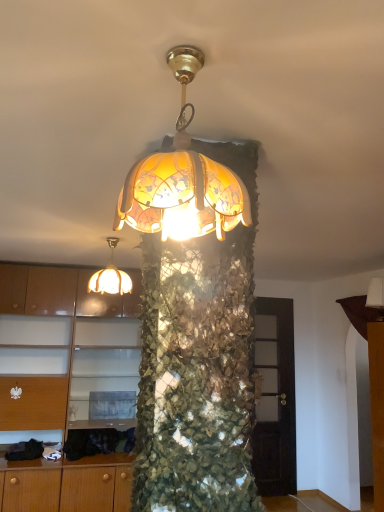
How much space does translucent glass lampshade at center, which is the first lamp in front-to-back order, occupy horizontally?

27.78 centimeters.

This screenshot has width=384, height=512. What do you see at coordinates (182, 179) in the screenshot?
I see `translucent glass lampshade at center, the second lamp when ordered from right to left` at bounding box center [182, 179].

This screenshot has width=384, height=512. I want to click on translucent glass lampshade at center, the third lamp positioned from the back, so click(182, 179).

Considering the relative positions of translucent glass lampshade at center, the 2th lamp in the left-to-right sequence, and translucent glass lampshade at upper center, which ranks as the first lamp in left-to-right order, in the image provided, is translucent glass lampshade at center, the 2th lamp in the left-to-right sequence, to the left or to the right of translucent glass lampshade at upper center, which ranks as the first lamp in left-to-right order,?

Based on their positions, translucent glass lampshade at center, the 2th lamp in the left-to-right sequence, is located to the right of translucent glass lampshade at upper center, which ranks as the first lamp in left-to-right order.

Does translucent glass lampshade at center, which is the first lamp in front-to-back order, touch translucent glass lampshade at upper center, which ranks as the first lamp in left-to-right order?

translucent glass lampshade at center, which is the first lamp in front-to-back order, and translucent glass lampshade at upper center, which ranks as the first lamp in left-to-right order, are clearly separated.

Can you confirm if translucent glass lampshade at center, the third lamp positioned from the back, is taller than translucent glass lampshade at upper center, which ranks as the 2th lamp in back-to-front order?

Correct, translucent glass lampshade at center, the third lamp positioned from the back, is much taller as translucent glass lampshade at upper center, which ranks as the 2th lamp in back-to-front order.

Which object is positioned more to the right, translucent glass lampshade at upper center, which ranks as the 2th lamp in back-to-front order, or matte wood cabinet at left?

translucent glass lampshade at upper center, which ranks as the 2th lamp in back-to-front order.

Which of these two, translucent glass lampshade at upper center, which ranks as the first lamp in left-to-right order, or matte wood cabinet at left, is thinner?

Thinner between the two is translucent glass lampshade at upper center, which ranks as the first lamp in left-to-right order.

Are translucent glass lampshade at upper center, which ranks as the first lamp in left-to-right order, and matte wood cabinet at left making contact?

translucent glass lampshade at upper center, which ranks as the first lamp in left-to-right order, and matte wood cabinet at left are clearly separated.

Is matte wood cabinet at left surrounding translucent glass lampshade at center, the third lamp positioned from the back?

No, translucent glass lampshade at center, the third lamp positioned from the back, is located outside of matte wood cabinet at left.

Is point (41, 276) positioned behind point (171, 194)?

Yes, point (41, 276) is behind point (171, 194).

From a real-world perspective, relative to translucent glass lampshade at center, which is the first lamp in front-to-back order, is matte wood cabinet at left vertically above or below?

matte wood cabinet at left is below translucent glass lampshade at center, which is the first lamp in front-to-back order.

Considering the sizes of objects matte wood cabinet at left and translucent glass lampshade at center, the 2th lamp in the left-to-right sequence, in the image provided, who is bigger, matte wood cabinet at left or translucent glass lampshade at center, the 2th lamp in the left-to-right sequence,?

matte wood cabinet at left.

You are a GUI agent. You are given a task and a screenshot of the screen. Output one action in this format:
    pyautogui.click(x=<x>, y=<y>)
    Task: Click on the 1st lamp to the right of the translucent glass lampshade at upper center, which ranks as the first lamp in left-to-right order, counting from the anchor's position
    The height and width of the screenshot is (512, 384).
    Given the screenshot: What is the action you would take?
    pyautogui.click(x=182, y=179)

Who is smaller, translucent glass lampshade at upper center, which is the 3th lamp in right-to-left order, or translucent glass lampshade at center, which is the first lamp in front-to-back order?

translucent glass lampshade at upper center, which is the 3th lamp in right-to-left order, is smaller.

Is translucent glass lampshade at upper center, which ranks as the 2th lamp in back-to-front order, taller than translucent glass lampshade at center, the second lamp when ordered from right to left?

No.

Is the surface of matte wood cabinet at left in direct contact with translucent glass lampshade at upper center, which ranks as the 2th lamp in back-to-front order?

No.

Considering the sizes of matte wood cabinet at left and translucent glass lampshade at upper center, which ranks as the first lamp in left-to-right order, in the image, is matte wood cabinet at left wider or thinner than translucent glass lampshade at upper center, which ranks as the first lamp in left-to-right order,?

matte wood cabinet at left is wider than translucent glass lampshade at upper center, which ranks as the first lamp in left-to-right order.

From the image's perspective, which is above, matte wood cabinet at left or translucent glass lampshade at upper center, which is the 3th lamp in right-to-left order?

From the image's view, translucent glass lampshade at upper center, which is the 3th lamp in right-to-left order, is above.

Considering the sizes of matte wood cabinet at left and translucent glass lampshade at upper center, which ranks as the first lamp in left-to-right order, in the image, is matte wood cabinet at left taller or shorter than translucent glass lampshade at upper center, which ranks as the first lamp in left-to-right order,?

In the image, matte wood cabinet at left appears to be taller than translucent glass lampshade at upper center, which ranks as the first lamp in left-to-right order.

In terms of height, does white fabric lampshade at upper right, the first lamp from the back, look taller or shorter compared to translucent glass lampshade at center, the third lamp positioned from the back?

Considering their sizes, white fabric lampshade at upper right, the first lamp from the back, has less height than translucent glass lampshade at center, the third lamp positioned from the back.

Is white fabric lampshade at upper right, the 1th lamp positioned from the right, spatially inside translucent glass lampshade at center, the second lamp when ordered from right to left, or outside of it?

The correct answer is: outside.

Does white fabric lampshade at upper right, acting as the 3th lamp starting from the front, appear on the right side of translucent glass lampshade at center, the third lamp positioned from the back?

Yes, white fabric lampshade at upper right, acting as the 3th lamp starting from the front, is to the right of translucent glass lampshade at center, the third lamp positioned from the back.

Is matte wood cabinet at left at the back of translucent glass lampshade at center, which is the first lamp in front-to-back order?

No, matte wood cabinet at left is not at the back of translucent glass lampshade at center, which is the first lamp in front-to-back order.

From the image's perspective, is translucent glass lampshade at center, which is the first lamp in front-to-back order, on matte wood cabinet at left?

Indeed, from the image's perspective, translucent glass lampshade at center, which is the first lamp in front-to-back order, is shown above matte wood cabinet at left.

From a real-world perspective, is translucent glass lampshade at center, the second lamp when ordered from right to left, below matte wood cabinet at left?

No, from a real-world perspective, translucent glass lampshade at center, the second lamp when ordered from right to left, is not under matte wood cabinet at left.

Who is taller, translucent glass lampshade at center, the third lamp positioned from the back, or matte wood cabinet at left?

With more height is matte wood cabinet at left.

This screenshot has width=384, height=512. In order to click on lamp that is on the left side of translucent glass lampshade at center, which is the first lamp in front-to-back order in this screenshot , I will do `click(110, 276)`.

There is a matte wood cabinet at left. Where is `the 3rd lamp above it (from a real-world perspective)`? the 3rd lamp above it (from a real-world perspective) is located at coordinates (110, 276).

From the picture: When comparing their distances from matte wood cabinet at left, does translucent glass lampshade at center, the second lamp when ordered from right to left, or translucent glass lampshade at upper center, which ranks as the first lamp in left-to-right order, seem further?

translucent glass lampshade at center, the second lamp when ordered from right to left, is positioned further to the anchor matte wood cabinet at left.

When comparing their distances from translucent glass lampshade at upper center, which is the 3th lamp in right-to-left order, does white fabric lampshade at upper right, acting as the 3th lamp starting from the front, or translucent glass lampshade at center, the 2th lamp in the left-to-right sequence, seem further?

white fabric lampshade at upper right, acting as the 3th lamp starting from the front, is positioned further to the anchor translucent glass lampshade at upper center, which is the 3th lamp in right-to-left order.

Which object lies further to the anchor point translucent glass lampshade at center, the third lamp positioned from the back, white fabric lampshade at upper right, the 1th lamp positioned from the right, or translucent glass lampshade at upper center, which is the 2th lamp in front-to-back order?

Based on the image, white fabric lampshade at upper right, the 1th lamp positioned from the right, appears to be further to translucent glass lampshade at center, the third lamp positioned from the back.

From the image, which object appears to be farther from matte wood cabinet at left, white fabric lampshade at upper right, the 1th lamp positioned from the right, or translucent glass lampshade at center, which is the first lamp in front-to-back order?

The object further to matte wood cabinet at left is translucent glass lampshade at center, which is the first lamp in front-to-back order.

When comparing their distances from white fabric lampshade at upper right, the 3th lamp in the left-to-right sequence, does translucent glass lampshade at upper center, which is the 3th lamp in right-to-left order, or matte wood cabinet at left seem closer?

translucent glass lampshade at upper center, which is the 3th lamp in right-to-left order, is closer to white fabric lampshade at upper right, the 3th lamp in the left-to-right sequence.

From the image, which object appears to be nearer to translucent glass lampshade at center, which is the first lamp in front-to-back order, matte wood cabinet at left or translucent glass lampshade at upper center, which is the 2th lamp in front-to-back order?

The object closer to translucent glass lampshade at center, which is the first lamp in front-to-back order, is translucent glass lampshade at upper center, which is the 2th lamp in front-to-back order.

Estimate the real-world distances between objects in this image. Which object is closer to white fabric lampshade at upper right, acting as the 3th lamp starting from the front, translucent glass lampshade at center, which is the first lamp in front-to-back order, or translucent glass lampshade at upper center, which ranks as the 2th lamp in back-to-front order?

Based on the image, translucent glass lampshade at upper center, which ranks as the 2th lamp in back-to-front order, appears to be nearer to white fabric lampshade at upper right, acting as the 3th lamp starting from the front.

Estimate the real-world distances between objects in this image. Which object is further from white fabric lampshade at upper right, the first lamp from the back, matte wood cabinet at left or translucent glass lampshade at center, which is the first lamp in front-to-back order?

translucent glass lampshade at center, which is the first lamp in front-to-back order, lies further to white fabric lampshade at upper right, the first lamp from the back, than the other object.

I want to click on lamp positioned between translucent glass lampshade at center, the 2th lamp in the left-to-right sequence, and white fabric lampshade at upper right, acting as the 3th lamp starting from the front, from near to far, so click(x=110, y=276).